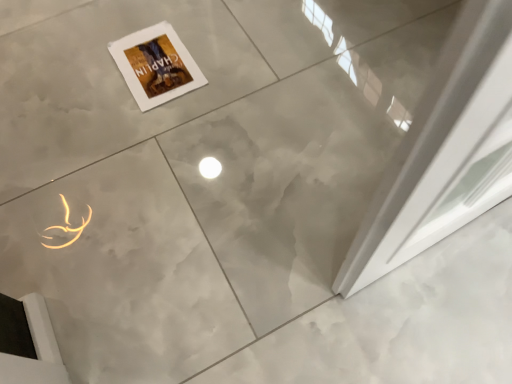
You are a GUI agent. You are given a task and a screenshot of the screen. Output one action in this format:
    pyautogui.click(x=<x>, y=<y>)
    Task: Click on the vacant space to the right of white paper at upper left
    The width and height of the screenshot is (512, 384).
    Given the screenshot: What is the action you would take?
    pyautogui.click(x=231, y=61)